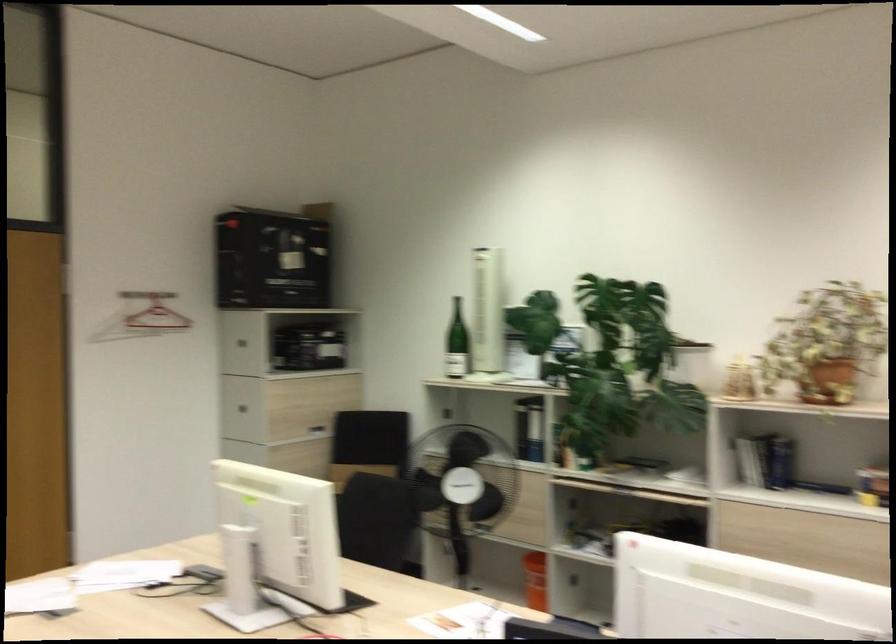
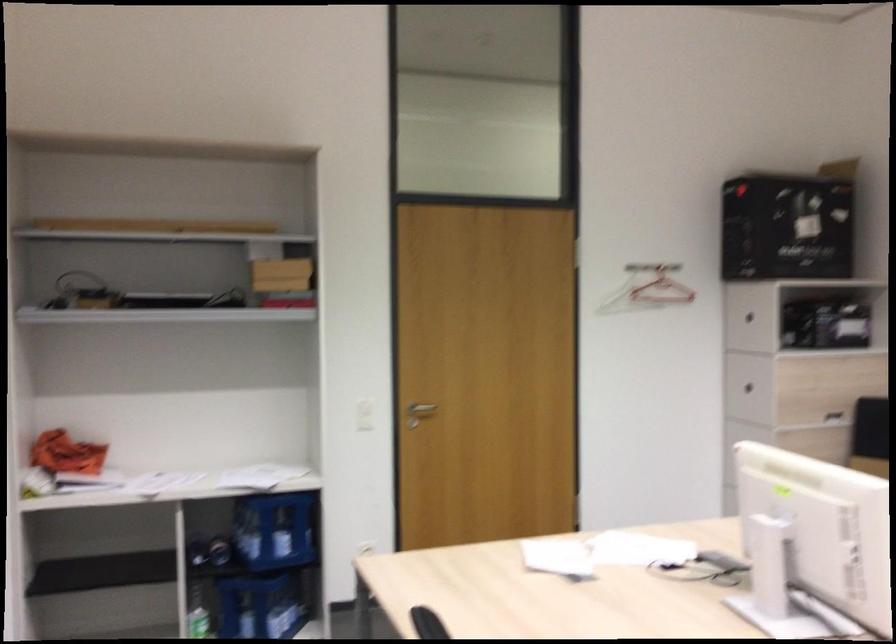
Question: The images are taken continuously from a first-person perspective. In which direction is your viewpoint rotating?

Choices:
 (A) Left
 (B) Right
 (C) Up
 (D) Down

Answer: (A)